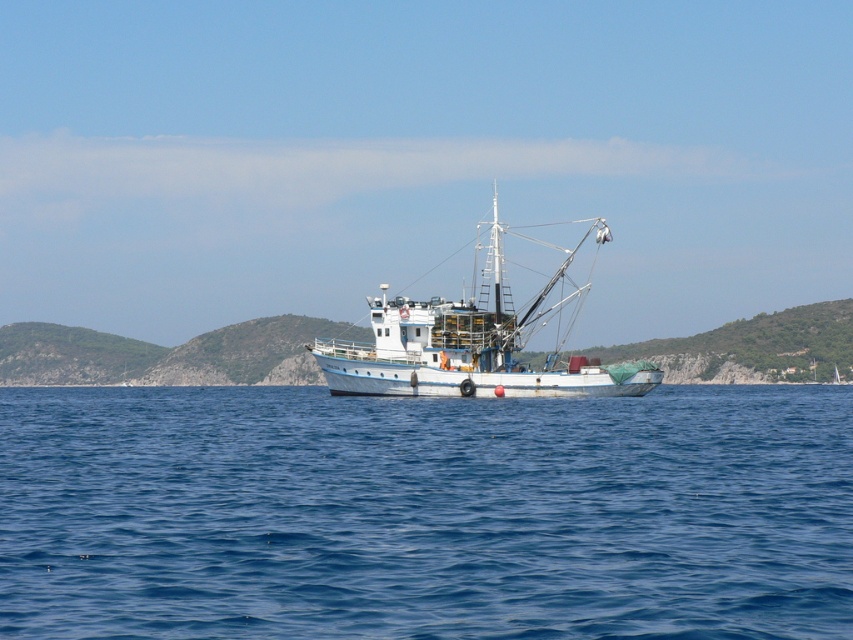
Is blue water at center taller than white matte boat at center?

No.

Who is more forward, (363, 570) or (473, 291)?

Point (363, 570) is more forward.

This screenshot has height=640, width=853. What are the coordinates of `blue water at center` in the screenshot? It's located at pyautogui.click(x=424, y=513).